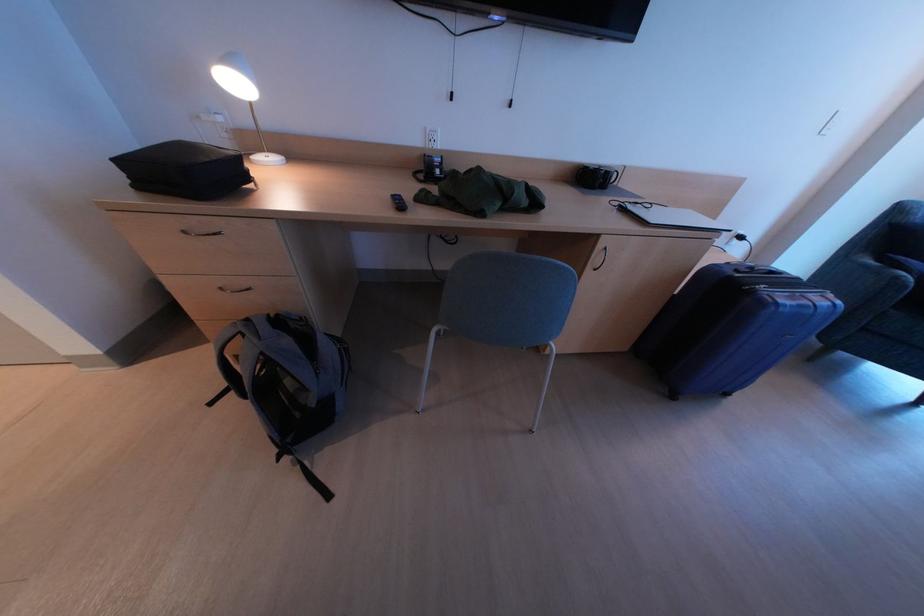
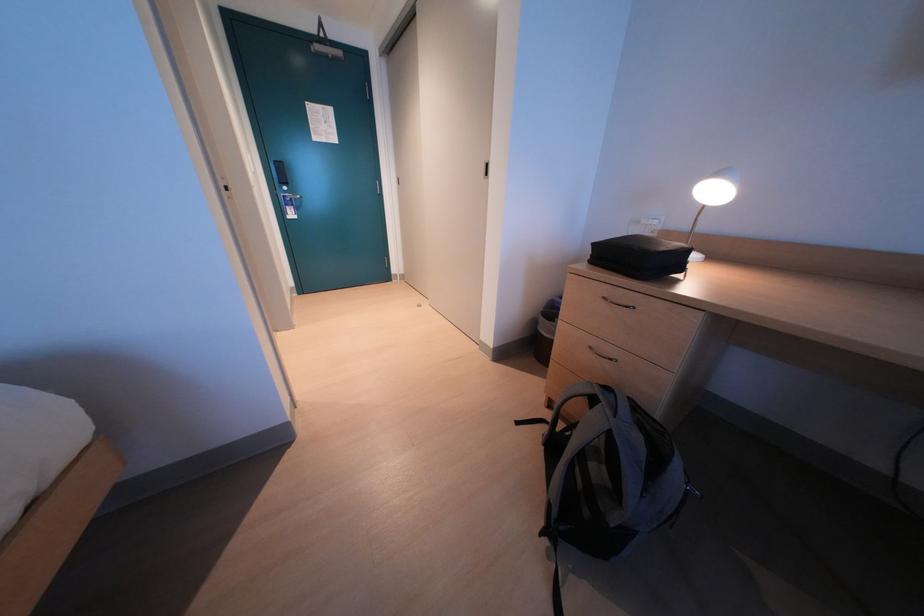
Question: Based on the continuous images, in which direction is the camera rotating? Reply with the corresponding letter.

Choices:
 (A) Left
 (B) Right
 (C) Up
 (D) Down

Answer: (A)